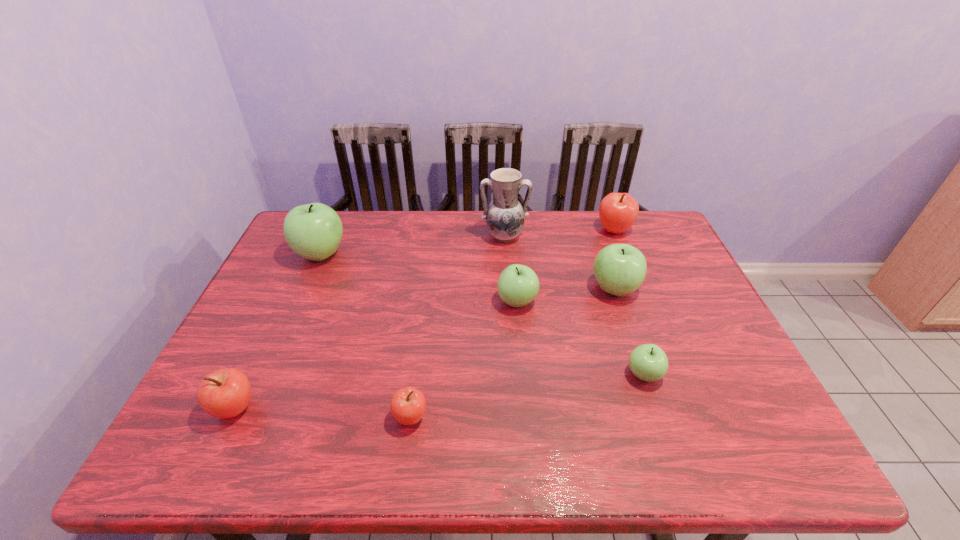
Identify the location of empty location between the second pink apple from right to left and the third smallest green apple. The height and width of the screenshot is (540, 960). (513, 353).

The image size is (960, 540). In order to click on vacant space that is in between the farthest pink apple and the third object from left to right in this screenshot , I will do pos(513,324).

I want to click on vacant area that lies between the second biggest pink apple and the second tallest object, so click(x=277, y=331).

Image resolution: width=960 pixels, height=540 pixels. What are the coordinates of `unoccupied position between the second smallest green apple and the second biggest pink apple` in the screenshot? It's located at (376, 355).

Where is `free space between the smallest green apple and the leftmost pink apple`? The width and height of the screenshot is (960, 540). free space between the smallest green apple and the leftmost pink apple is located at coordinates (440, 392).

Find the location of `vacant space in between the farthest green apple and the second pink apple from left to right`. vacant space in between the farthest green apple and the second pink apple from left to right is located at coordinates (366, 336).

Where is `blank region between the smallest green apple and the second smallest pink apple`? The image size is (960, 540). blank region between the smallest green apple and the second smallest pink apple is located at coordinates (440, 392).

You are a GUI agent. You are given a task and a screenshot of the screen. Output one action in this format:
    pyautogui.click(x=<x>, y=<y>)
    Task: Click on the unoccupied area between the second biggest pink apple and the third smallest green apple
    This screenshot has width=960, height=540.
    Given the screenshot: What is the action you would take?
    pyautogui.click(x=424, y=348)

Identify the location of vacant space that is in between the tallest object and the second biggest green apple. (559, 262).

This screenshot has height=540, width=960. I want to click on vacant point located between the smallest pink apple and the farthest pink apple, so click(513, 324).